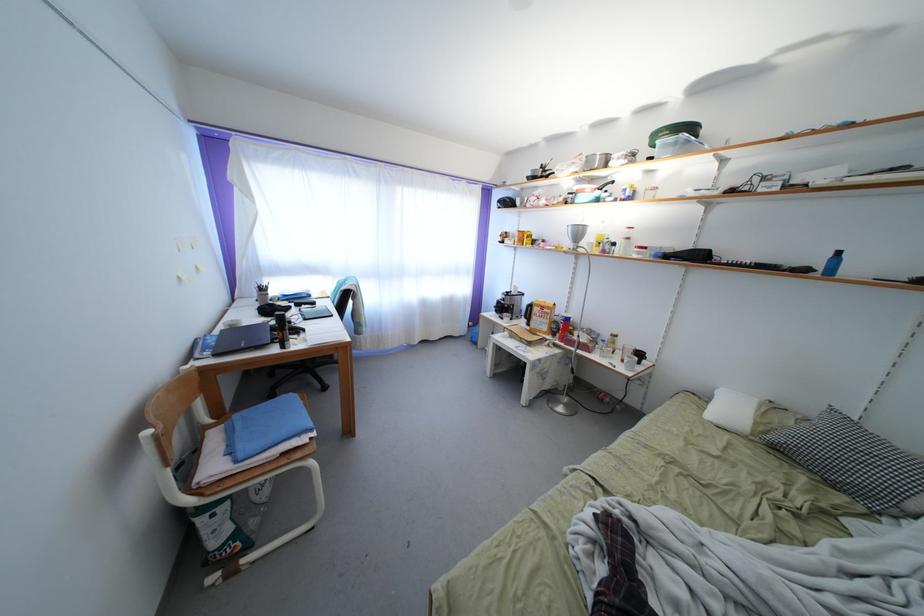
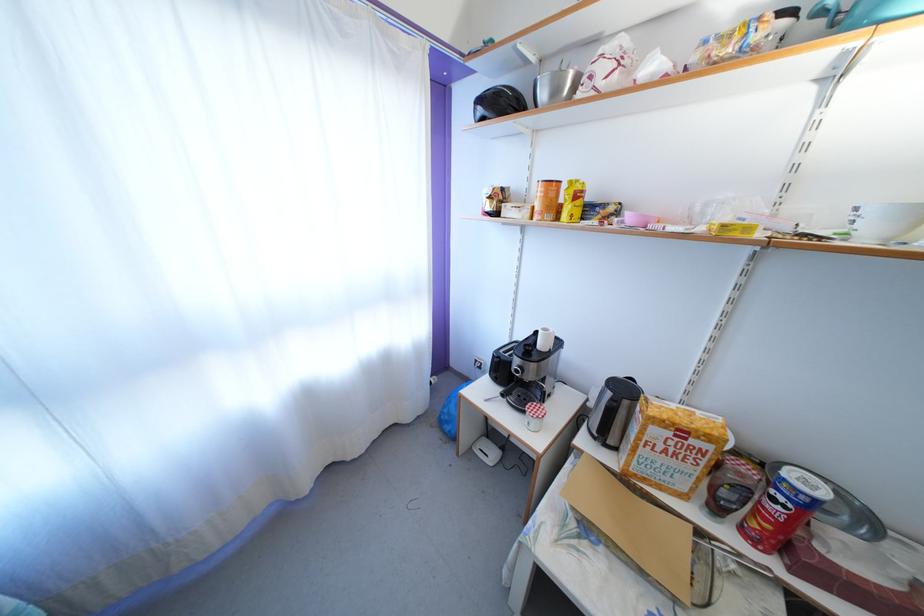
Where in the second image is the point corresponding to (x=505, y=207) from the first image?

(484, 107)